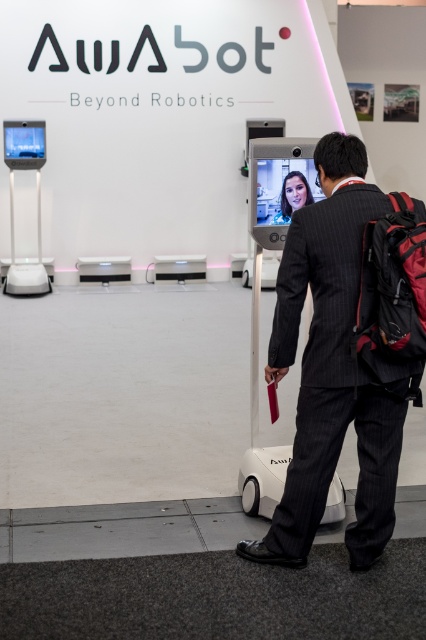
You are standing in front of the robotic device labeled Awabot at the exhibition. There are two points marked in the image. Which point is closer to you, point (282,358) or point (285,188)?

Point (282,358) is closer to the viewer than point (285,188).

In the scene shown: You are a photographer at the exhibition. You want to take a photo of the matte black screen at center without including the dark gray pinstripe suit at center in the frame. Is this possible given their positions?

The dark gray pinstripe suit at center is in front of the matte black screen at center, so it would block the view. Therefore, it is not possible to take a photo of the matte black screen at center without including the dark gray pinstripe suit at center in the frame.

You are a photographer at the exhibition. You want to take a photo that includes both the dark gray pinstripe suit at center and the matte black screen at center. Which object should you position closer to the camera to ensure both are in focus?

The dark gray pinstripe suit at center is taller than the matte black screen at center, so positioning the dark gray pinstripe suit at center closer to the camera will help ensure both objects are in focus since it is larger and might require more emphasis in the frame.